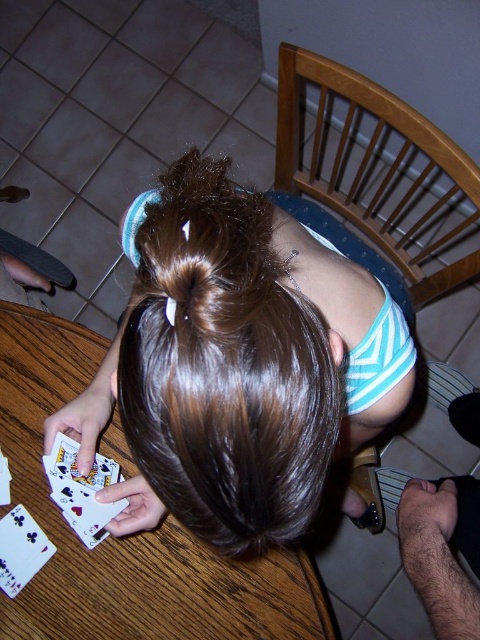
Does brown shiny hair at center appear under wooden table at center?

No.

Does brown shiny hair at center have a lesser width compared to wooden table at center?

Yes, brown shiny hair at center is thinner than wooden table at center.

I want to click on brown shiny hair at center, so click(239, 364).

The width and height of the screenshot is (480, 640). Identify the location of brown shiny hair at center. (239, 364).